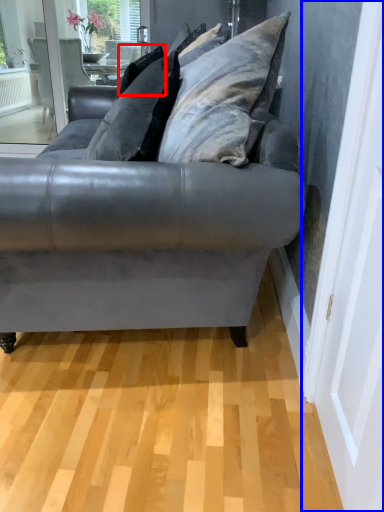
Question: Which of the following is the farthest to the observer, pillow (highlighted by a red box) or screen door (highlighted by a blue box)?

Choices:
 (A) pillow
 (B) screen door

Answer: (A)